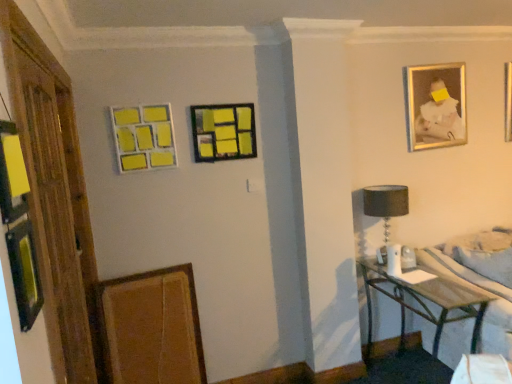
Question: From the image's perspective, is wooden bed frame at lower right above or below wooden textured picture frame at lower left, the first picture frame from the bottom?

Choices:
 (A) below
 (B) above

Answer: (B)

Question: Considering the relative positions of wooden bed frame at lower right and wooden textured picture frame at lower left, the 4th picture frame when ordered from top to bottom, in the image provided, is wooden bed frame at lower right to the left or to the right of wooden textured picture frame at lower left, the 4th picture frame when ordered from top to bottom,?

Choices:
 (A) left
 (B) right

Answer: (B)

Question: Estimate the real-world distances between objects in this image. Which object is closer to the wooden bed frame at lower right?

Choices:
 (A) yellow matte picture frame at upper left, which is counted as the 3th picture frame, starting from the top
 (B) transparent glass door at left
 (C) matte black picture frame at center, the 3th picture frame ordered from the bottom
 (D) wooden textured picture frame at lower left, positioned as the second picture frame in left-to-right order
 (E) metallic silver table at lower right

Answer: (E)

Question: Which object is positioned farthest from the yellow matte picture frame at upper left, which is the 1th picture frame in left-to-right order?

Choices:
 (A) gold-framed photo at upper right, the fourth picture frame in the bottom-to-top sequence
 (B) metallic silver table at lower right
 (C) wooden bed frame at lower right
 (D) black fabric lampshade at right
 (E) wooden textured picture frame at lower left, acting as the 3th picture frame starting from the right

Answer: (C)